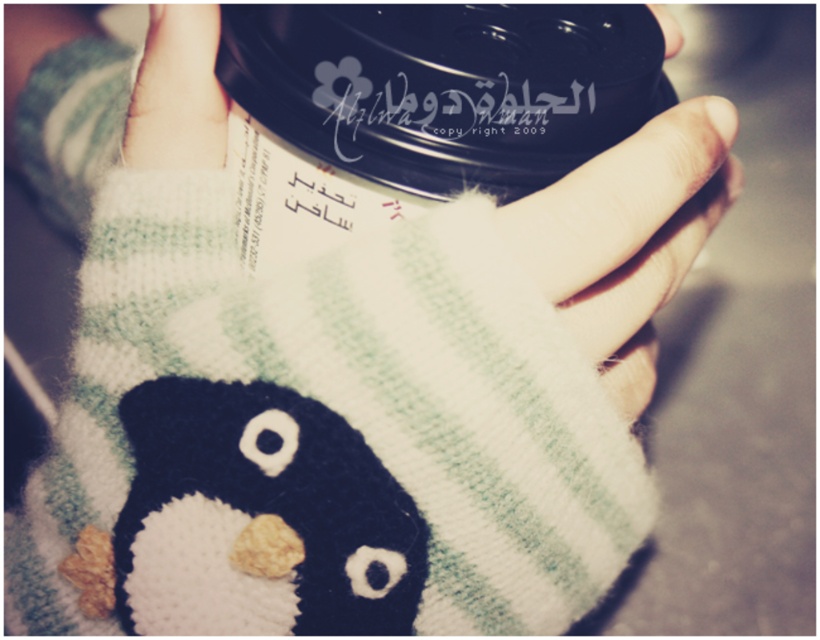
Question: Among these points, which one is farthest from the camera?

Choices:
 (A) pos(164,140)
 (B) pos(231,451)

Answer: (A)

Question: Does white knitted penguin at lower left appear under white knitted glove at upper left?

Choices:
 (A) yes
 (B) no

Answer: (A)

Question: Does white knitted penguin at lower left appear over white knitted glove at upper left?

Choices:
 (A) no
 (B) yes

Answer: (A)

Question: Is white knitted penguin at lower left to the right of white knitted glove at upper left from the viewer's perspective?

Choices:
 (A) no
 (B) yes

Answer: (B)

Question: Which object is farther from the camera taking this photo?

Choices:
 (A) white knitted glove at upper left
 (B) white knitted penguin at lower left

Answer: (A)

Question: Which point is farther from the camera taking this photo?

Choices:
 (A) (144, 508)
 (B) (148, 35)

Answer: (B)